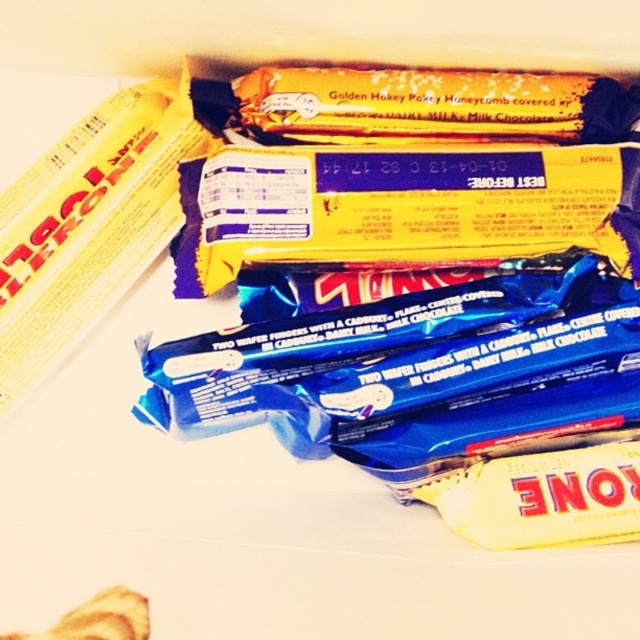
Question: Is yellow matte chocolate bar at center to the left of golden honeycomb at upper center from the viewer's perspective?

Choices:
 (A) no
 (B) yes

Answer: (A)

Question: Does yellow matte chocolate bar at center have a larger size compared to golden honeycomb at upper center?

Choices:
 (A) no
 (B) yes

Answer: (B)

Question: From the image, what is the correct spatial relationship of yellow matte chocolate bar at center in relation to golden honeycomb at upper center?

Choices:
 (A) below
 (B) above

Answer: (B)

Question: Among these objects, which one is nearest to the camera?

Choices:
 (A) golden honeycomb at upper center
 (B) yellow matte chocolate bar at center

Answer: (A)